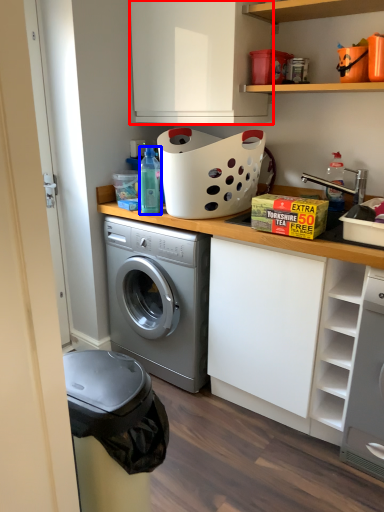
Question: Which object is closer to the camera taking this photo, cabinetry (highlighted by a red box) or bottle (highlighted by a blue box)?

Choices:
 (A) cabinetry
 (B) bottle

Answer: (A)